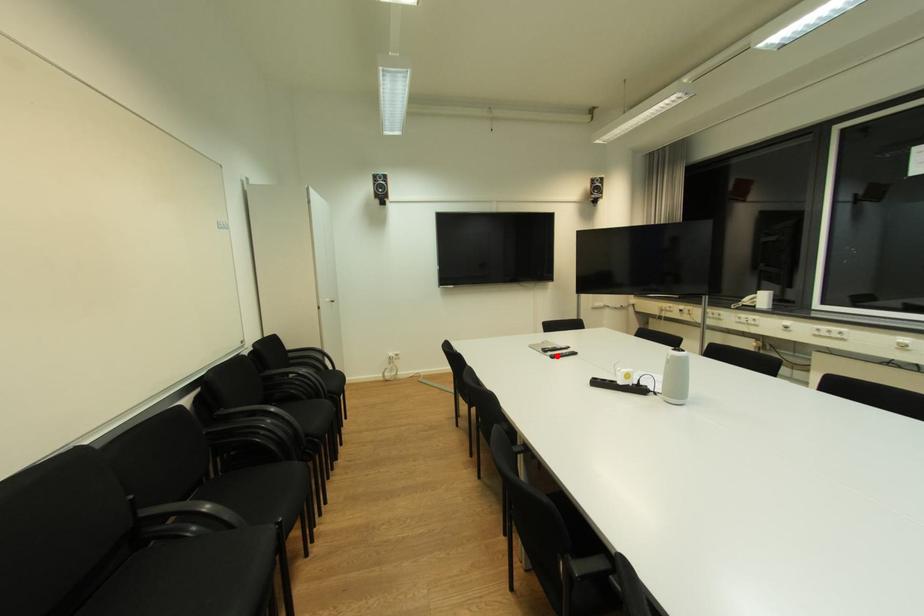
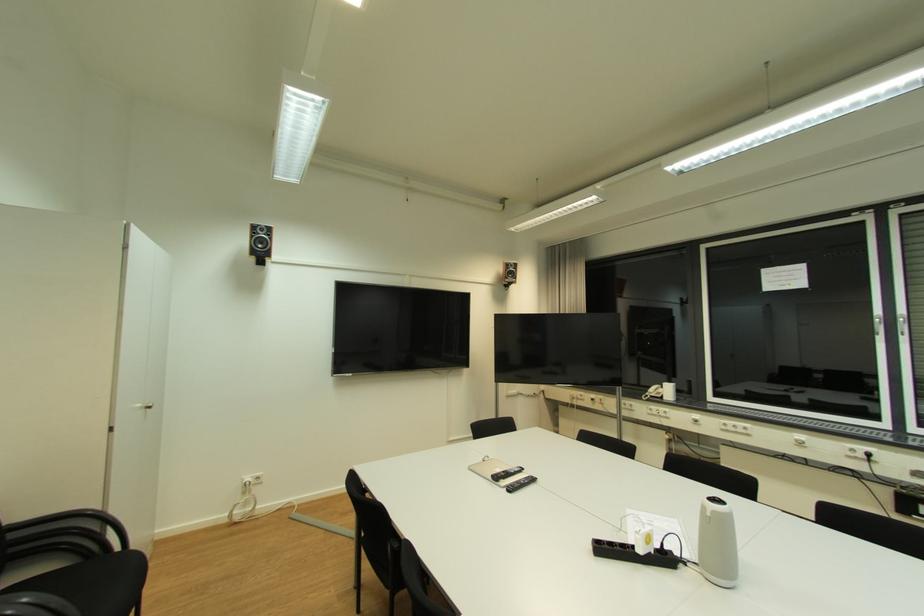
Where in the second image is the point corresponding to the highlighted location from the first image?

(514, 488)